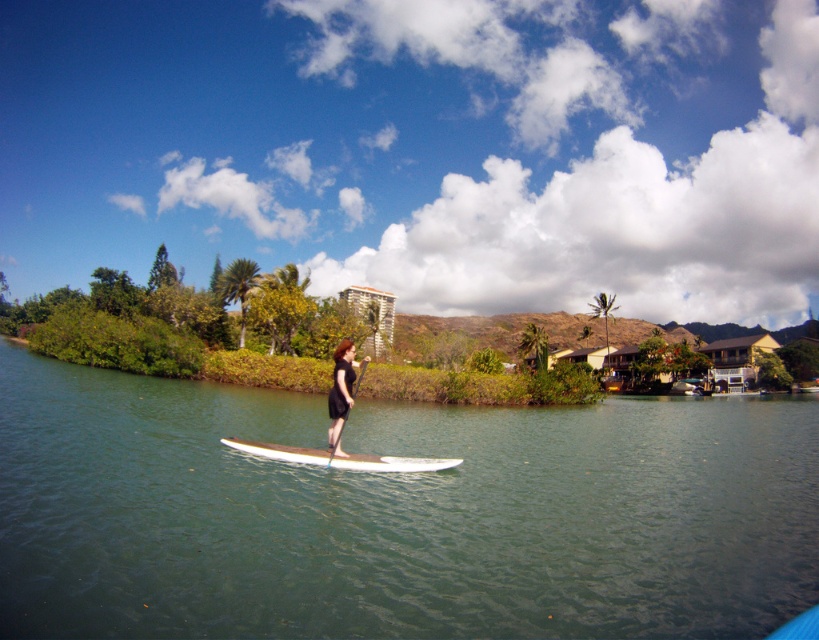
You are a photographer trying to capture the white glossy paddleboard at center and the green smooth water at center in the same frame. Based on their positions, which object should you adjust your camera to focus on first if you want to include both in your shot?

The green smooth water at center is to the right of the white glossy paddleboard at center. To include both in the shot, focus on the white glossy paddleboard at center first since it is positioned to the left, then adjust to include the green smooth water at center to its right.

You are standing on the white paddleboard with a brown top and want to reach both the point at coordinates point (x=572, y=410) and point (x=390, y=461). Which point is closer to you?

Point (x=390, y=461) is closer to you because it is nearer to the viewer compared to point (x=572, y=410), which is further away.